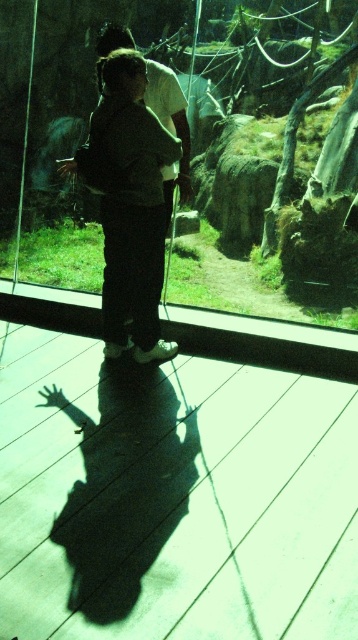
Question: Is transparent glass door at center to the left of dark gray pants at center from the viewer's perspective?

Choices:
 (A) no
 (B) yes

Answer: (A)

Question: Which point is closer to the camera?

Choices:
 (A) dark gray pants at center
 (B) transparent glass door at center

Answer: (A)

Question: Which object is farther from the camera taking this photo?

Choices:
 (A) transparent glass door at center
 (B) dark gray pants at center

Answer: (A)

Question: Observing the image, what is the correct spatial positioning of transparent glass door at center in reference to dark gray pants at center?

Choices:
 (A) right
 (B) left

Answer: (A)

Question: Is transparent glass door at center positioned at the back of dark gray pants at center?

Choices:
 (A) yes
 (B) no

Answer: (A)